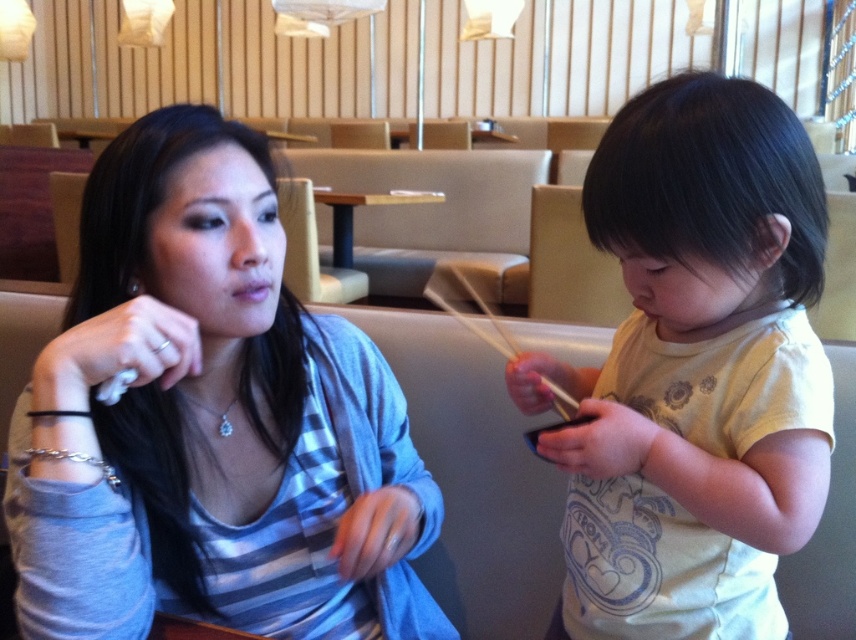
Which is behind, point (100, 616) or point (621, 419)?

The point (621, 419) is more distant.

Is matte gray cardigan at center further to camera compared to light yellow cotton shirt at right?

That is True.

Between point (128, 429) and point (575, 500), which one is positioned in front?

Point (128, 429)

This screenshot has width=856, height=640. Find the location of `matte gray cardigan at center`. matte gray cardigan at center is located at coordinates (205, 403).

Measure the distance between point (670, 276) and camera.

They are 25.68 inches apart.

Can you confirm if light yellow cotton shirt at right is positioned below wooden table at center?

Indeed, light yellow cotton shirt at right is positioned under wooden table at center.

Find the location of a particular element. The height and width of the screenshot is (640, 856). light yellow cotton shirt at right is located at coordinates (694, 371).

Locate an element on the screen. light yellow cotton shirt at right is located at coordinates (694, 371).

Is light yellow cotton shirt at right wider than wooden chopsticks at center?

Correct, the width of light yellow cotton shirt at right exceeds that of wooden chopsticks at center.

Identify the location of light yellow cotton shirt at right. (694, 371).